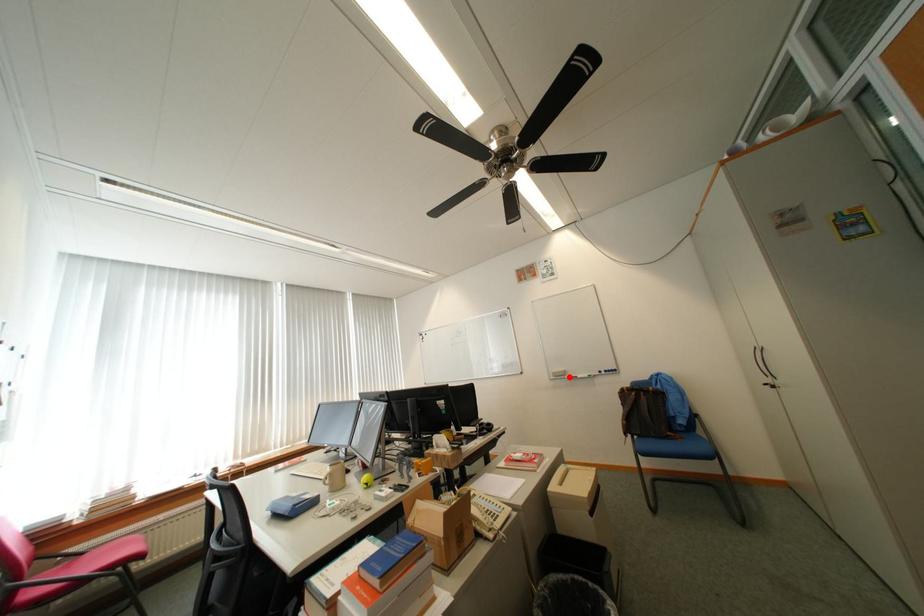
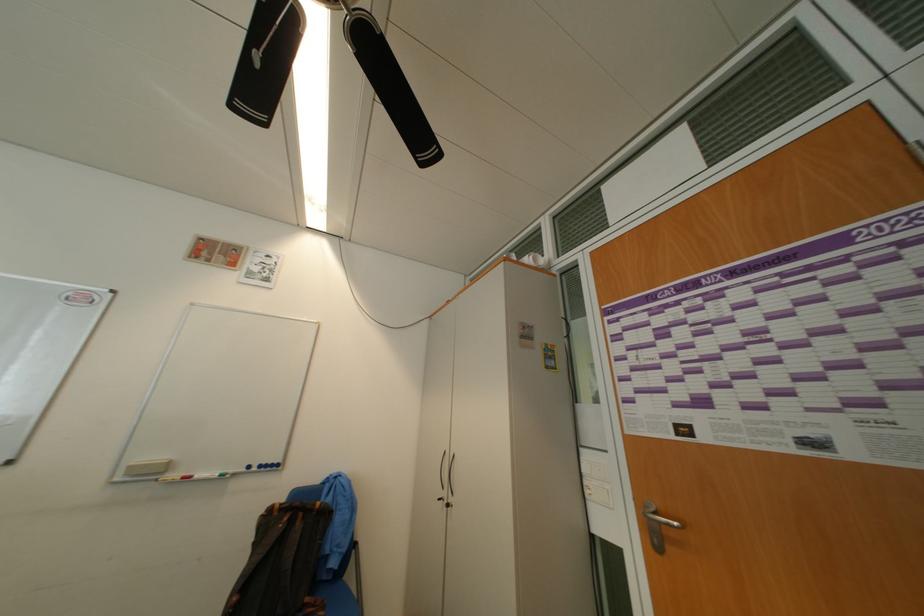
Locate, in the second image, the point that corresponds to the highlighted location in the first image.

(159, 475)